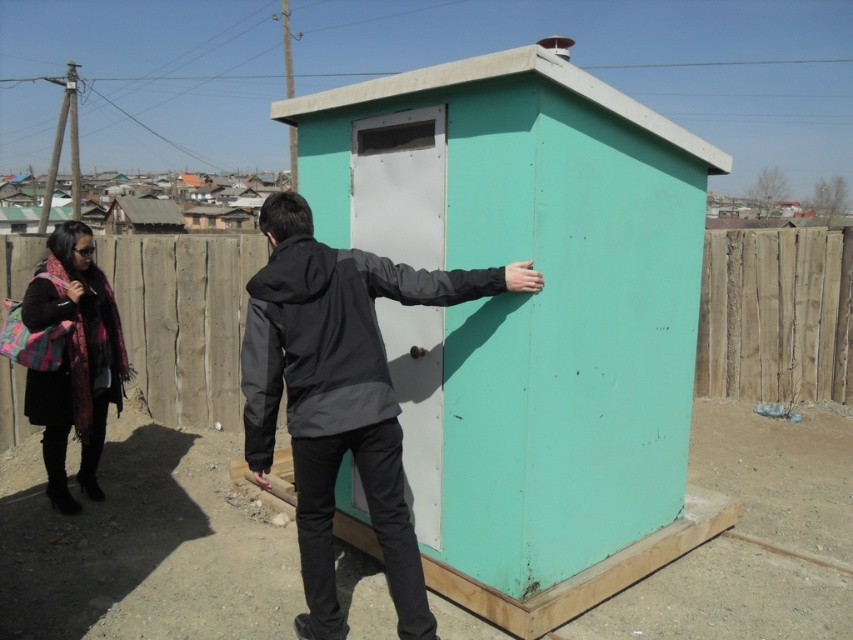
Measure the distance from wooden fence at lower center to multicolored scarf at left.

wooden fence at lower center and multicolored scarf at left are 2.06 meters apart from each other.

Which is below, wooden fence at lower center or multicolored scarf at left?

Positioned lower is multicolored scarf at left.

Which is behind, point (798, 298) or point (102, 298)?

Point (798, 298)

Image resolution: width=853 pixels, height=640 pixels. Identify the location of wooden fence at lower center. (x=775, y=316).

Which is below, brown wooden fence at lower left or weathered wood fence at center?

brown wooden fence at lower left

The height and width of the screenshot is (640, 853). What do you see at coordinates (184, 320) in the screenshot?
I see `brown wooden fence at lower left` at bounding box center [184, 320].

Describe the element at coordinates (184, 320) in the screenshot. The width and height of the screenshot is (853, 640). I see `brown wooden fence at lower left` at that location.

Find the location of a particular element. brown wooden fence at lower left is located at coordinates (184, 320).

Consider the image. Between weathered wood fence at center and multicolored scarf at left, which one has more height?

With more height is multicolored scarf at left.

Is weathered wood fence at center taller than multicolored scarf at left?

No, weathered wood fence at center is not taller than multicolored scarf at left.

Is point (704, 252) closer to viewer compared to point (54, 394)?

No, (704, 252) is further to viewer.

Image resolution: width=853 pixels, height=640 pixels. Identify the location of weathered wood fence at center. (776, 314).